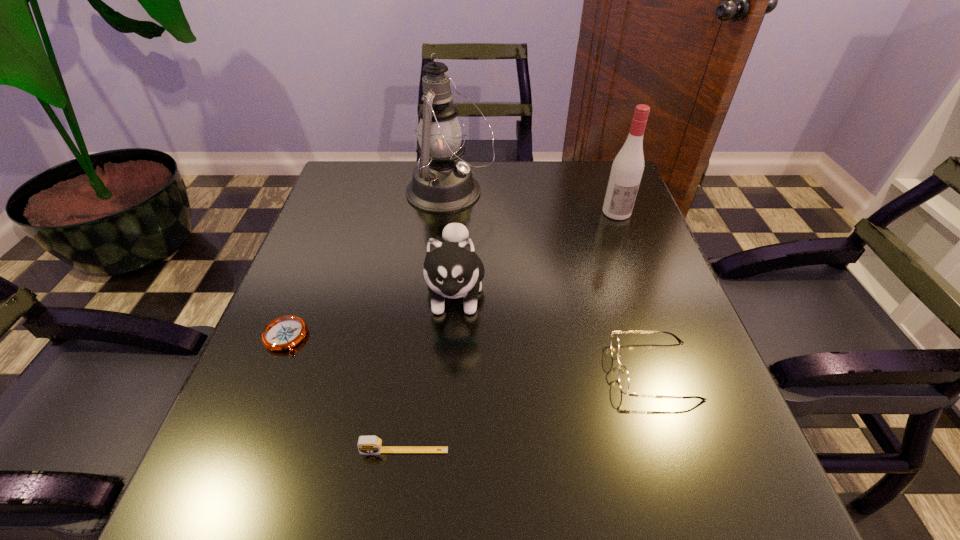
The height and width of the screenshot is (540, 960). What are the coordinates of `spectacles that is positioned at the right edge` in the screenshot? It's located at (623, 376).

What are the coordinates of `object located in the far right corner section of the desktop` in the screenshot? It's located at (627, 169).

In the image, there is a desktop. Identify the location of vacant space at the far edge. (410, 206).

This screenshot has height=540, width=960. In order to click on blank area at the near edge in this screenshot , I will do `click(444, 493)`.

Locate an element on the screen. The width and height of the screenshot is (960, 540). free region at the left edge is located at coordinates (351, 229).

Where is `blank space at the right edge of the desktop`? This screenshot has width=960, height=540. blank space at the right edge of the desktop is located at coordinates (636, 281).

Locate an element on the screen. vacant space at the far left corner of the desktop is located at coordinates (383, 185).

I want to click on free space between the puppy and the alcohol, so click(x=536, y=253).

At what (x,y) coordinates should I click in order to perform the action: click on vacant region between the spectacles and the tallest object. Please return your answer as a coordinate pair (x, y). The image size is (960, 540). Looking at the image, I should click on (552, 281).

Identify the location of vacant region between the compass and the puppy. (371, 315).